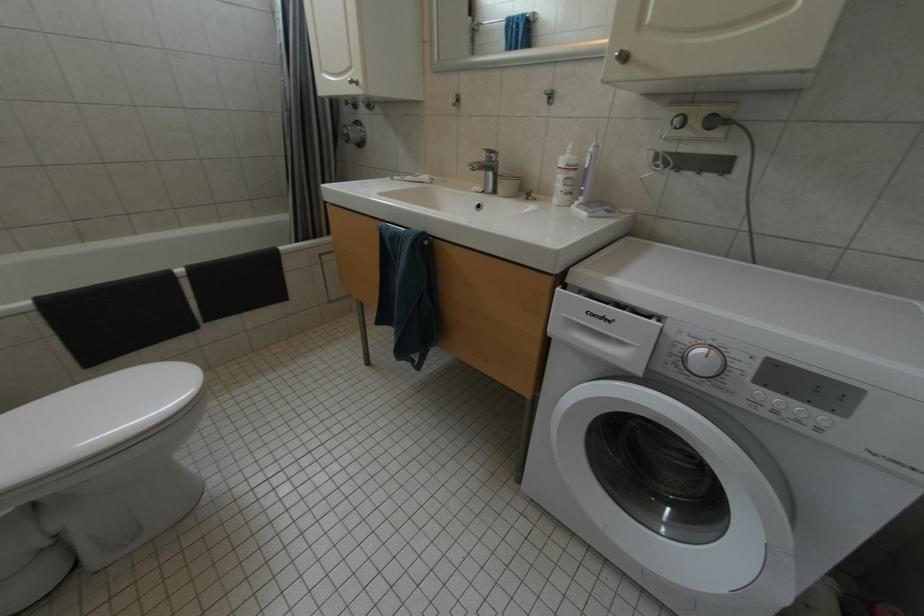
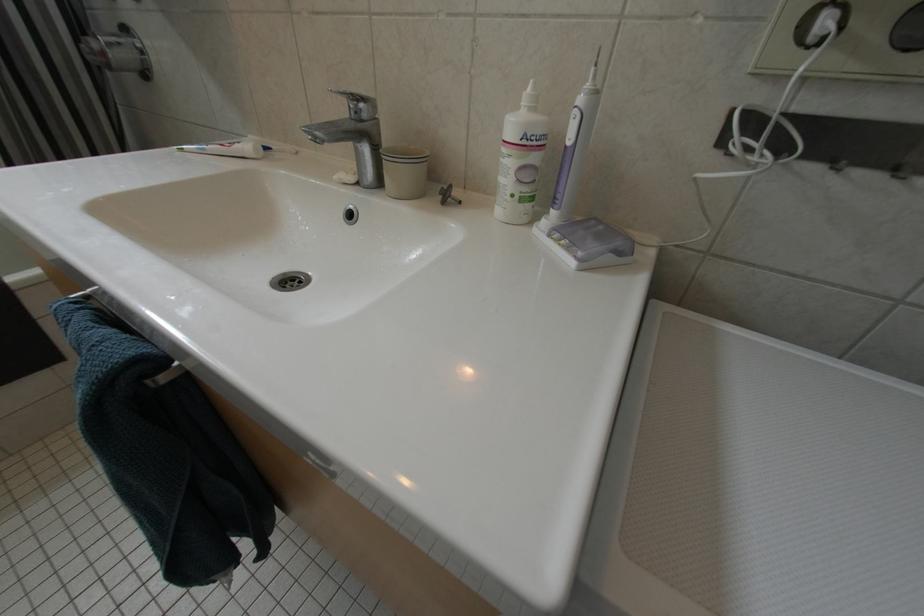
Question: The camera is either moving clockwise (left) or counter-clockwise (right) around the object. The first image is from the beginning of the video and the second image is from the end. Is the camera moving left or right when shooting the video?

Choices:
 (A) Left
 (B) Right

Answer: (A)